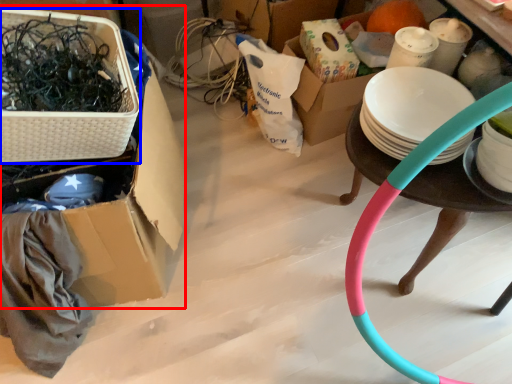
Question: Among these objects, which one is farthest to the camera, box (highlighted by a red box) or basket (highlighted by a blue box)?

Choices:
 (A) box
 (B) basket

Answer: (A)